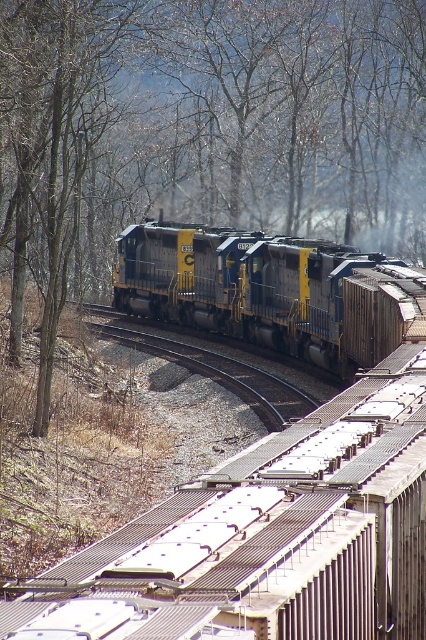
You are a train engineer who needs to ensure the train stays on the tracks. You notice a point marked at coordinates (203, 129). Where is this point located in relation to the train and the surrounding area?

The point at (203, 129) is on a brown bark tree at upper left, which is located away from the train tracks and the freight train itself.

You are a train engineer who needs to ensure the train stays on track. The train is currently moving along the curved railway. Based on the scene, where is the brown bark tree at upper left located in relation to the train tracks?

The brown bark tree at upper left is located at point (x=203, y=129), which is outside the train tracks, so it is not obstructing the train.